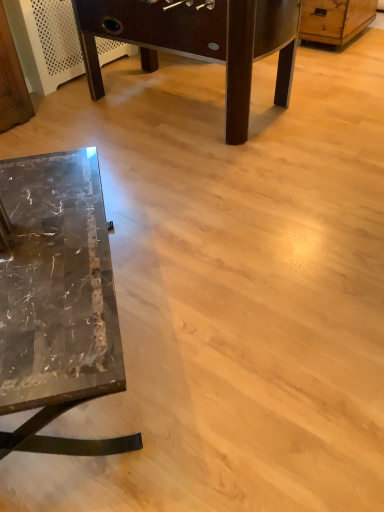
Find the location of a particular element. free point in front of wooden dresser at upper right is located at coordinates (334, 61).